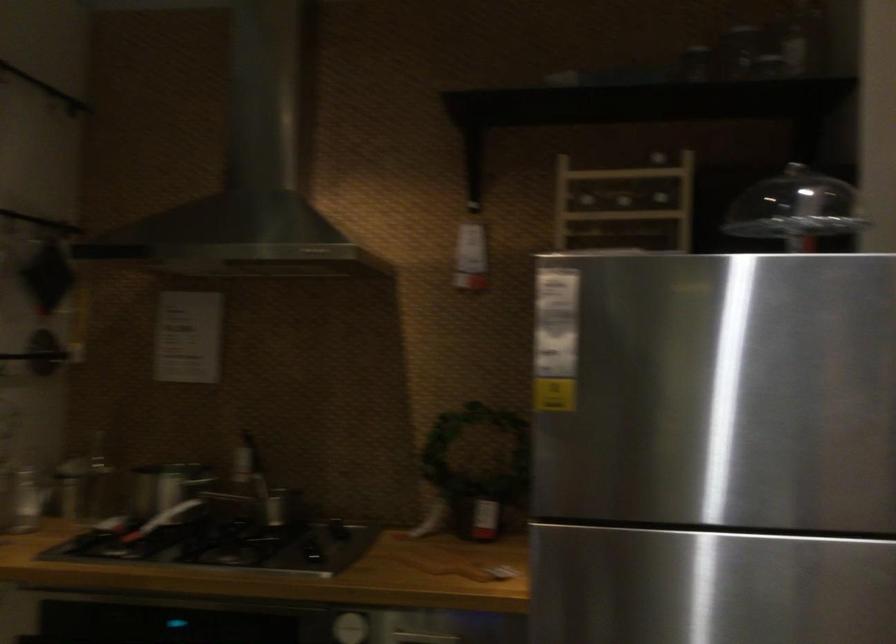
Identify the location of black pan handle. Image resolution: width=896 pixels, height=644 pixels. (195, 478).